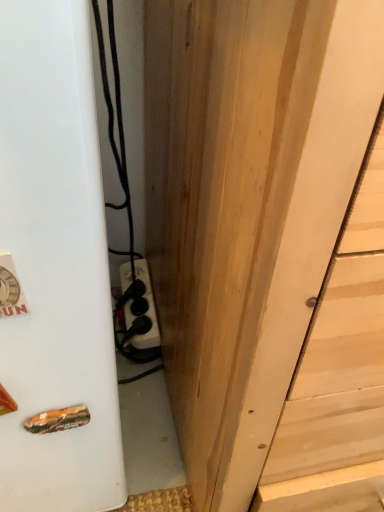
Question: Does point (288, 74) appear closer or farther from the camera than point (96, 150)?

Choices:
 (A) closer
 (B) farther

Answer: (A)

Question: Considering the positions of natural wood door at center and white matte refrigerator at left in the image, is natural wood door at center taller or shorter than white matte refrigerator at left?

Choices:
 (A) short
 (B) tall

Answer: (B)

Question: Do you think natural wood door at center is within white matte refrigerator at left, or outside of it?

Choices:
 (A) outside
 (B) inside

Answer: (A)

Question: Is white matte refrigerator at left in front of or behind natural wood door at center in the image?

Choices:
 (A) front
 (B) behind

Answer: (B)

Question: Is white matte refrigerator at left bigger or smaller than natural wood door at center?

Choices:
 (A) big
 (B) small

Answer: (B)

Question: Is point (0, 95) closer or farther from the camera than point (322, 269)?

Choices:
 (A) closer
 (B) farther

Answer: (A)

Question: From the image's perspective, is white matte refrigerator at left positioned above or below natural wood door at center?

Choices:
 (A) below
 (B) above

Answer: (A)